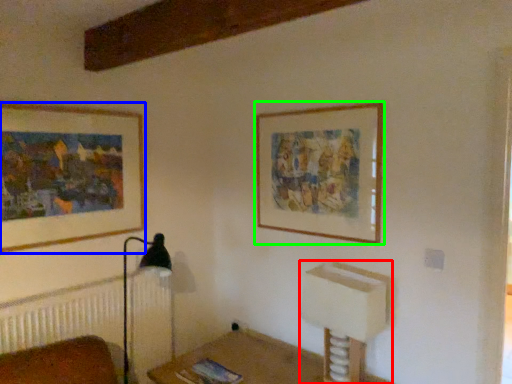
Question: Based on their relative distances, which object is nearer to vanity (highlighted by a red box)? Choose from picture frame (highlighted by a blue box) and picture frame (highlighted by a green box).

Choices:
 (A) picture frame
 (B) picture frame

Answer: (B)